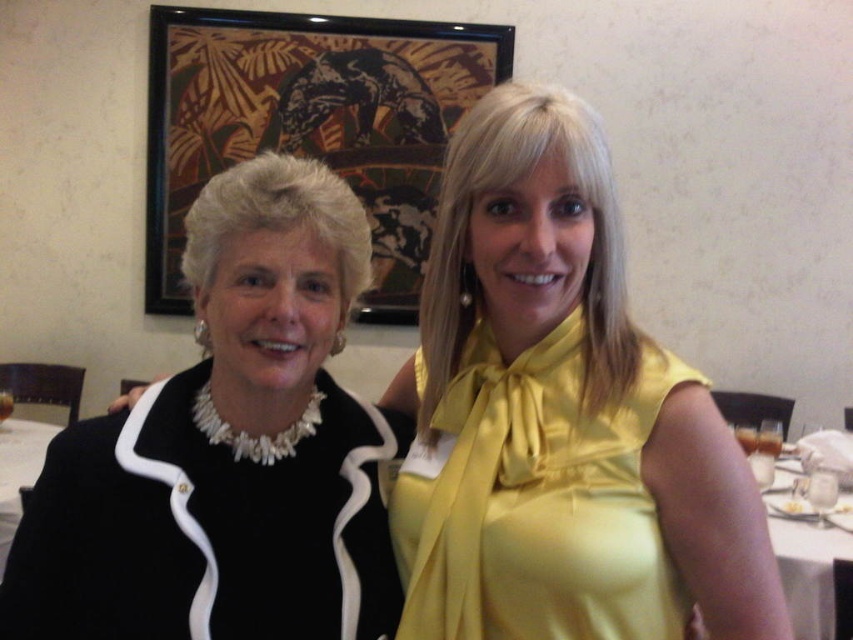
Which is more to the left, yellow satin blouse at center or satin yellow dress at center?

yellow satin blouse at center is more to the left.

Is yellow satin blouse at center positioned at the back of satin yellow dress at center?

Yes, yellow satin blouse at center is behind satin yellow dress at center.

Measure the distance between point (699,490) and camera.

Point (699,490) is 78.31 centimeters away from camera.

At what (x,y) coordinates should I click in order to perform the action: click on yellow satin blouse at center. Please return your answer as a coordinate pair (x, y). This screenshot has height=640, width=853. Looking at the image, I should click on (560, 417).

Between point (325, 352) and point (418, 632), which one is positioned behind?

The point (418, 632) is behind.

Is point (82, 609) behind point (612, 493)?

That is True.

You are a GUI agent. You are given a task and a screenshot of the screen. Output one action in this format:
    pyautogui.click(x=<x>, y=<y>)
    Task: Click on the black satin jacket at left
    Image resolution: width=853 pixels, height=640 pixels.
    Given the screenshot: What is the action you would take?
    pyautogui.click(x=227, y=451)

Image resolution: width=853 pixels, height=640 pixels. Identify the location of black satin jacket at left. point(227,451).

Is yellow satin blouse at center behind black satin jacket at left?

That is True.

This screenshot has height=640, width=853. Describe the element at coordinates (560, 417) in the screenshot. I see `yellow satin blouse at center` at that location.

This screenshot has width=853, height=640. In order to click on yellow satin blouse at center in this screenshot , I will do `click(560, 417)`.